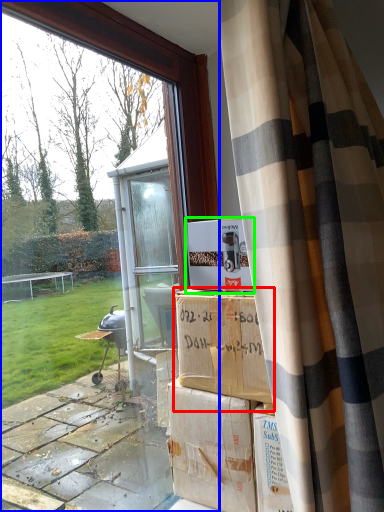
Question: Based on their relative distances, which object is nearer to cardboard box (highlighted by a red box)? Choose from window (highlighted by a blue box) and cardboard box (highlighted by a green box).

Choices:
 (A) window
 (B) cardboard box

Answer: (B)